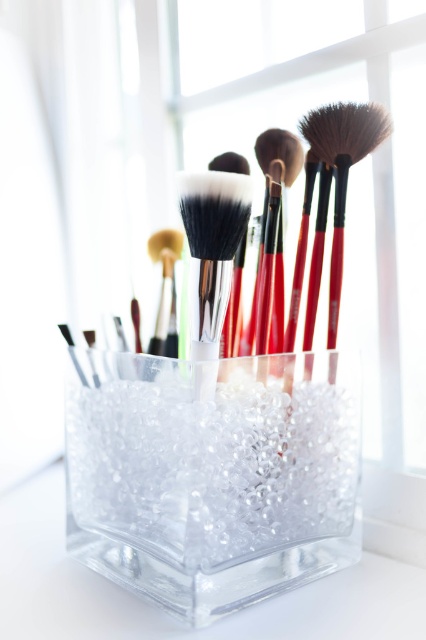
You are organizing your makeup brushes and notice the clear crystal glass at center and the soft white bristles at center. Which object is taller?

The clear crystal glass at center is taller than the soft white bristles at center.

You need to place a 4 inch ruler between the soft white bristles at center and the matte black brush at center. Will it fit without overlapping either?

The distance between the soft white bristles at center and the matte black brush at center is 3.75 inches. Since the ruler is 4 inches long, it will not fit without overlapping because the space is shorter than the ruler.

You are organizing a makeup kit and need to place a new brush. The brushes are stored in a clear glass container with a textured surface. There is a specific point marked at coordinates point (212, 474). Which object is located at this point?

The point (212, 474) marks the clear crystal glass at center.